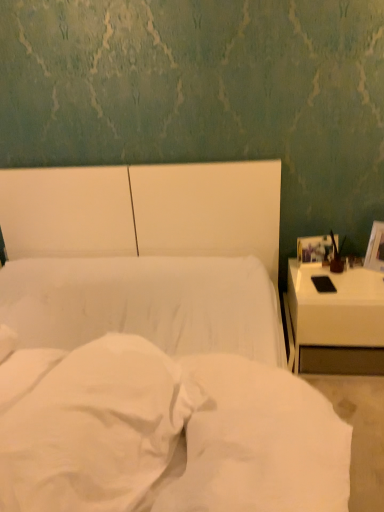
I want to click on unoccupied region to the right of matte brown vase at right, so click(362, 274).